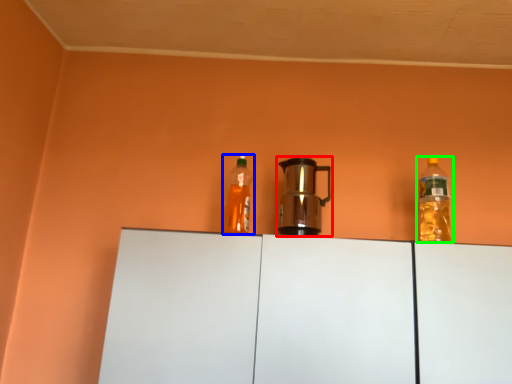
Question: Based on their relative distances, which object is nearer to kitchen appliance (highlighted by a red box)? Choose from bottle (highlighted by a blue box) and bottle (highlighted by a green box).

Choices:
 (A) bottle
 (B) bottle

Answer: (A)